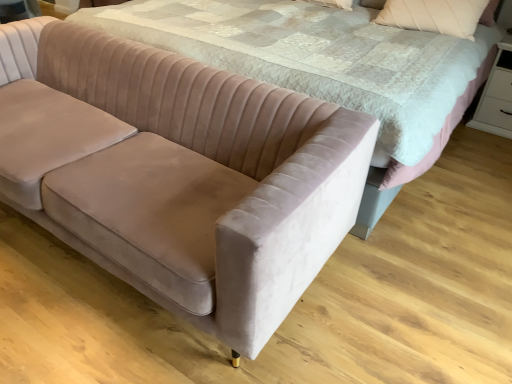
In order to click on free area in between velvet beige couch at lower left and velvet pink bed at center in this screenshot , I will do `click(335, 307)`.